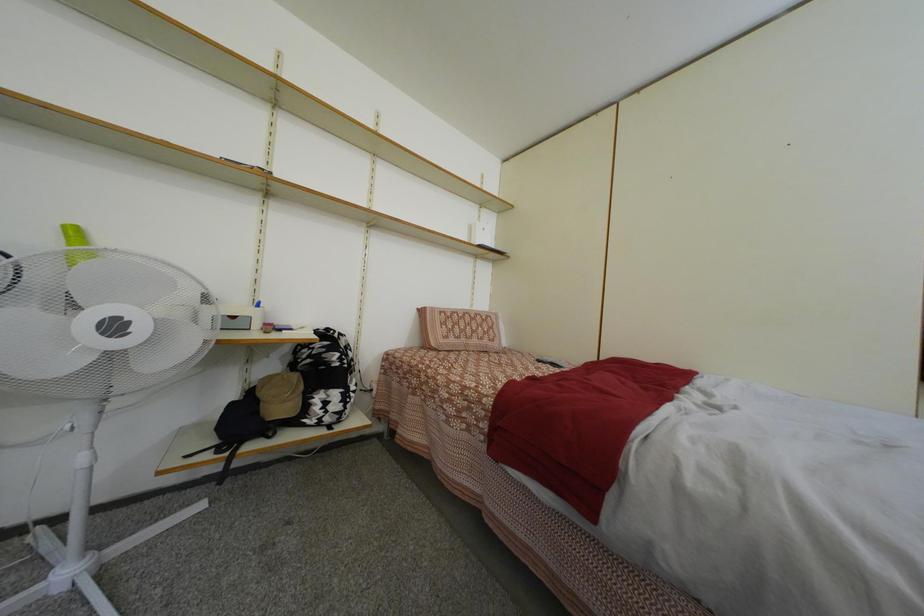
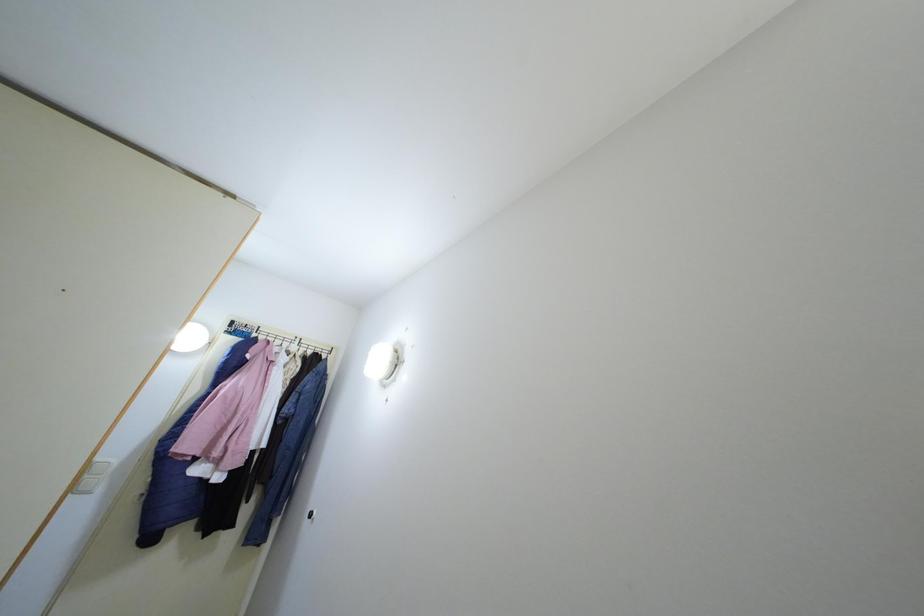
How did the camera likely rotate?

The rotation direction of the camera is right-up.